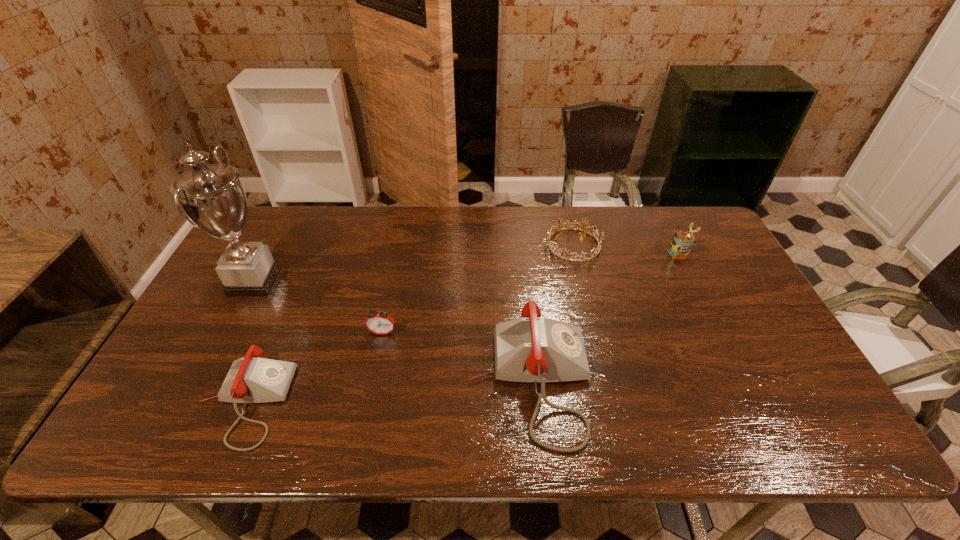
At what (x,y) coordinates should I click in order to perform the action: click on the left telephone. Please return your answer as a coordinate pair (x, y). Image resolution: width=960 pixels, height=540 pixels. Looking at the image, I should click on (252, 379).

Where is `the fifth tallest object`? the fifth tallest object is located at coordinates (252, 379).

At what (x,y) coordinates should I click in order to perform the action: click on the taller telephone. Please return your answer as a coordinate pair (x, y). The height and width of the screenshot is (540, 960). Looking at the image, I should click on (530, 349).

Locate an element on the screen. tiara is located at coordinates (548, 236).

I want to click on alarm clock, so click(x=380, y=323).

Identify the location of trophy cup. (213, 197).

Find the location of `the rightmost object`. the rightmost object is located at coordinates (682, 242).

Identify the location of free region located 0.370m on the dial of the shorter telephone. (444, 402).

Where is `vacant point located on the dial of the right telephone`? vacant point located on the dial of the right telephone is located at coordinates (680, 382).

Locate an element on the screen. vacant space located on the front-facing side of the shortest object is located at coordinates pos(452,245).